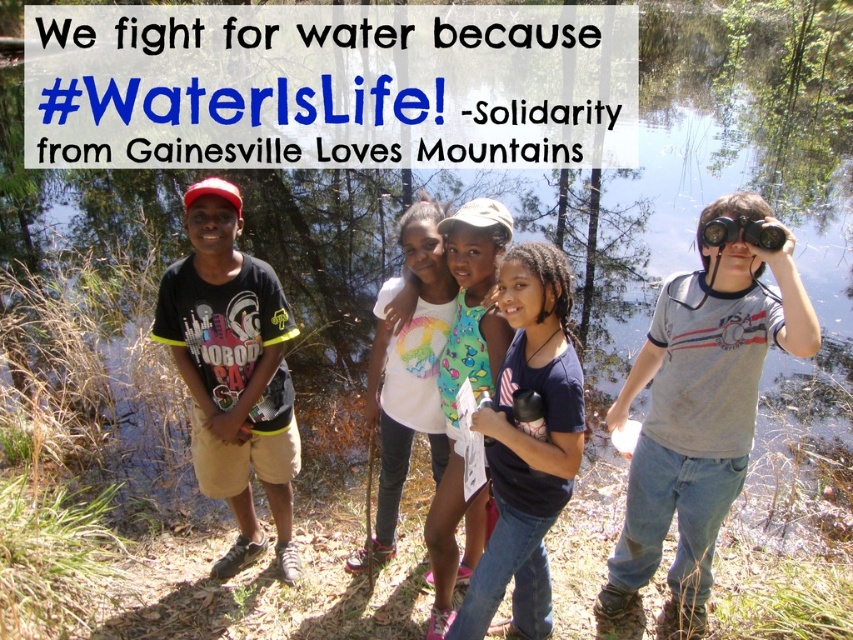
Question: Observing the image, what is the correct spatial positioning of gray cotton binoculars at right in reference to white cotton shirt at center?

Choices:
 (A) right
 (B) left

Answer: (A)

Question: Which point is closer to the camera?

Choices:
 (A) rainbow printed tank top at center
 (B) white cotton shirt at center

Answer: (A)

Question: Is gray cotton binoculars at right wider than white cotton shirt at center?

Choices:
 (A) yes
 (B) no

Answer: (B)

Question: Which object is the closest to the rainbow printed tank top at center?

Choices:
 (A) white cotton shirt at center
 (B) gray cotton binoculars at right

Answer: (A)

Question: Which point is farther from the camera taking this photo?

Choices:
 (A) (494, 348)
 (B) (426, 358)
 (C) (762, 321)

Answer: (B)

Question: Can you confirm if white cotton shirt at center is smaller than rainbow printed tank top at center?

Choices:
 (A) yes
 (B) no

Answer: (B)